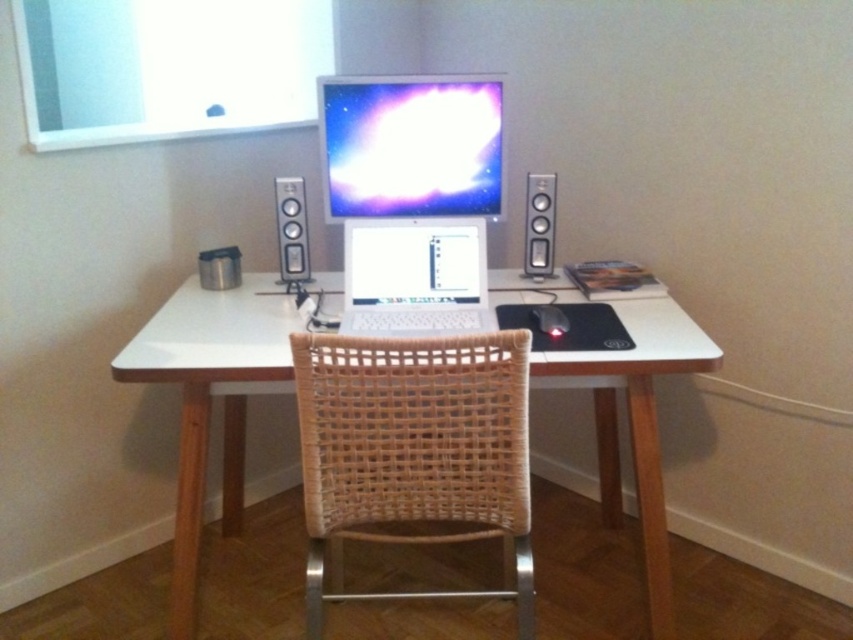
You are a delivery person who needs to place a small package on the desk in the home office scene. The desk has a coordinate system where the bottom left corner is the origin. The package must be placed at the point with coordinates closest to the point labeled as point (x=410, y=145). However, there is already an object at that location. What object is currently occupying that position?

The point labeled as point (x=410, y=145) corresponds to the matte plastic monitor at center, so the matte plastic monitor at center is occupying that position.

You are organizing a small snack on your desk and want to place it between the silver metallic laptop at center and the black matte mouse at center. What is the minimum width the snack plate should be to fit between them?

The minimum width the snack plate should be is 27.83 centimeters to fit between the silver metallic laptop at center and the black matte mouse at center.

You are sitting in a chair that is 1.5 meters away from the desk. You want to reach the silver metallic laptop at center without moving your chair. Can you do it?

The silver metallic laptop at center is 1.63 meters away from the viewer, which is farther than the 1.5 meters distance of the chair from the desk. Therefore, you cannot reach the silver metallic laptop at center without moving your chair.